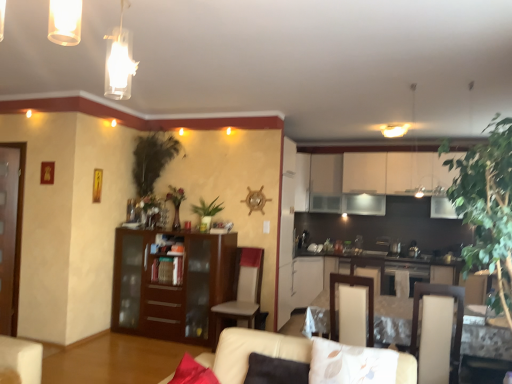
Question: Is green leafy plant at right, placed as the third plant when sorted from back to front, smaller than white glossy table at lower right?

Choices:
 (A) yes
 (B) no

Answer: (A)

Question: Considering the relative positions of green leafy plant at right, placed as the third plant when sorted from left to right, and white glossy table at lower right in the image provided, is green leafy plant at right, placed as the third plant when sorted from left to right, behind white glossy table at lower right?

Choices:
 (A) yes
 (B) no

Answer: (B)

Question: Is green leafy plant at right, placed as the third plant when sorted from back to front, to the left of white glossy table at lower right from the viewer's perspective?

Choices:
 (A) yes
 (B) no

Answer: (A)

Question: Is green leafy plant at right, the 1th plant from the right, wider than white glossy table at lower right?

Choices:
 (A) no
 (B) yes

Answer: (A)

Question: From the image's perspective, is green leafy plant at right, placed as the third plant when sorted from left to right, located beneath white glossy table at lower right?

Choices:
 (A) yes
 (B) no

Answer: (B)

Question: Based on their sizes in the image, would you say white glossy light fixture at upper center is bigger or smaller than green leafy plant at upper left, positioned as the first plant in back-to-front order?

Choices:
 (A) small
 (B) big

Answer: (A)

Question: From the image's perspective, is white glossy light fixture at upper center positioned above or below green leafy plant at upper left, arranged as the third plant when viewed from the right?

Choices:
 (A) above
 (B) below

Answer: (A)

Question: Relative to green leafy plant at upper left, positioned as the first plant in back-to-front order, is white glossy light fixture at upper center in front or behind?

Choices:
 (A) behind
 (B) front

Answer: (A)

Question: Do you think white glossy light fixture at upper center is within green leafy plant at upper left, which is counted as the third plant, starting from the front, or outside of it?

Choices:
 (A) inside
 (B) outside

Answer: (B)

Question: Is green leafy plant at upper left, the 1th plant positioned from the left, to the left or to the right of white glossy table at lower right in the image?

Choices:
 (A) left
 (B) right

Answer: (A)

Question: From a real-world perspective, relative to white glossy table at lower right, is green leafy plant at upper left, the 1th plant positioned from the left, vertically above or below?

Choices:
 (A) below
 (B) above

Answer: (B)

Question: Is point (166, 160) positioned closer to the camera than point (326, 291)?

Choices:
 (A) farther
 (B) closer

Answer: (A)

Question: Based on their sizes in the image, would you say green leafy plant at upper left, arranged as the third plant when viewed from the right, is bigger or smaller than white glossy table at lower right?

Choices:
 (A) big
 (B) small

Answer: (B)

Question: Considering the positions of point (413, 276) and point (197, 251), is point (413, 276) closer or farther from the camera than point (197, 251)?

Choices:
 (A) farther
 (B) closer

Answer: (B)

Question: In terms of width, does black stainless steel oven at center look wider or thinner when compared to dark brown wood cabinet at center?

Choices:
 (A) wide
 (B) thin

Answer: (B)